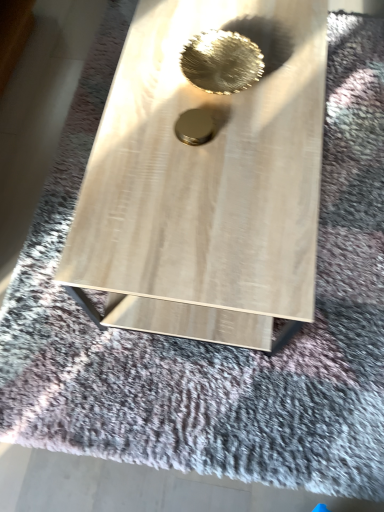
Question: Which direction should I rotate to look at gold metallic circle at center, the second hole in the top-to-bottom sequence, — up or down?

Choices:
 (A) up
 (B) down

Answer: (A)

Question: From a real-world perspective, is gold metallic circle at center, the second hole in the top-to-bottom sequence, located higher than metallic gold bowl at center, arranged as the first hole when viewed from the top?

Choices:
 (A) no
 (B) yes

Answer: (A)

Question: Is gold metallic circle at center, the second hole in the top-to-bottom sequence, outside of metallic gold bowl at center, acting as the 2th hole starting from the bottom?

Choices:
 (A) yes
 (B) no

Answer: (A)

Question: Are gold metallic circle at center, the second hole in the top-to-bottom sequence, and metallic gold bowl at center, arranged as the first hole when viewed from the top, beside each other?

Choices:
 (A) yes
 (B) no

Answer: (B)

Question: Does gold metallic circle at center, the second hole in the top-to-bottom sequence, have a smaller size compared to metallic gold bowl at center, arranged as the first hole when viewed from the top?

Choices:
 (A) no
 (B) yes

Answer: (B)

Question: Can you confirm if gold metallic circle at center, the second hole in the top-to-bottom sequence, is shorter than metallic gold bowl at center, acting as the 2th hole starting from the bottom?

Choices:
 (A) yes
 (B) no

Answer: (A)

Question: Can you confirm if gold metallic circle at center, arranged as the first hole when ordered from the bottom, is taller than metallic gold bowl at center, acting as the 2th hole starting from the bottom?

Choices:
 (A) no
 (B) yes

Answer: (A)

Question: Does metallic gold bowl at center, acting as the 2th hole starting from the bottom, come behind gold metallic circle at center, the second hole in the top-to-bottom sequence?

Choices:
 (A) no
 (B) yes

Answer: (B)

Question: Does metallic gold bowl at center, acting as the 2th hole starting from the bottom, have a smaller size compared to gold metallic circle at center, arranged as the first hole when ordered from the bottom?

Choices:
 (A) yes
 (B) no

Answer: (B)

Question: Is metallic gold bowl at center, acting as the 2th hole starting from the bottom, not within gold metallic circle at center, arranged as the first hole when ordered from the bottom?

Choices:
 (A) yes
 (B) no

Answer: (A)

Question: Can you confirm if metallic gold bowl at center, arranged as the first hole when viewed from the top, is taller than gold metallic circle at center, the second hole in the top-to-bottom sequence?

Choices:
 (A) yes
 (B) no

Answer: (A)

Question: From a real-world perspective, is metallic gold bowl at center, arranged as the first hole when viewed from the top, on top of gold metallic circle at center, arranged as the first hole when ordered from the bottom?

Choices:
 (A) no
 (B) yes

Answer: (B)

Question: Can gold metallic circle at center, arranged as the first hole when ordered from the bottom, be found inside metallic gold bowl at center, arranged as the first hole when viewed from the top?

Choices:
 (A) no
 (B) yes

Answer: (A)

Question: Is gold metallic circle at center, arranged as the first hole when ordered from the bottom, situated inside metallic gold bowl at center, arranged as the first hole when viewed from the top, or outside?

Choices:
 (A) inside
 (B) outside

Answer: (B)